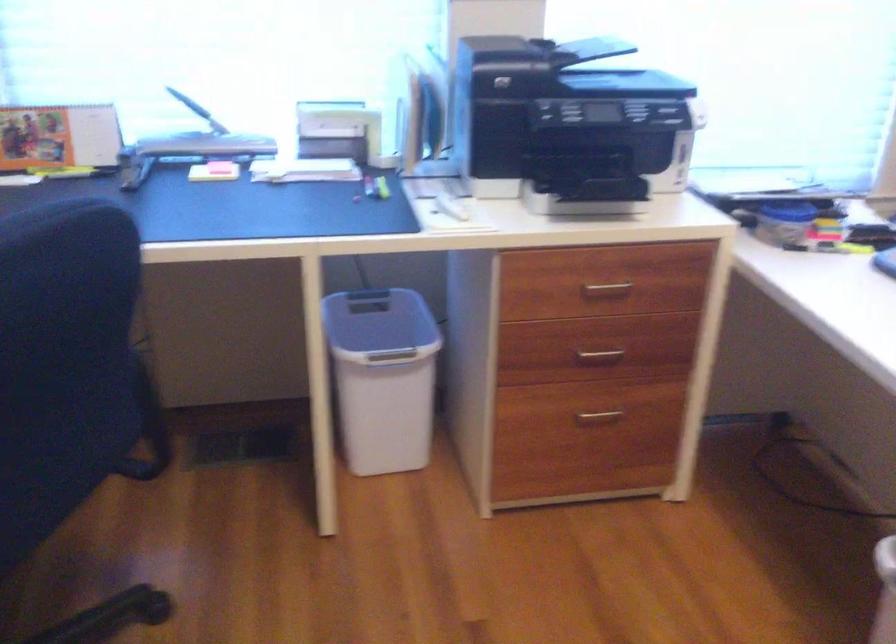
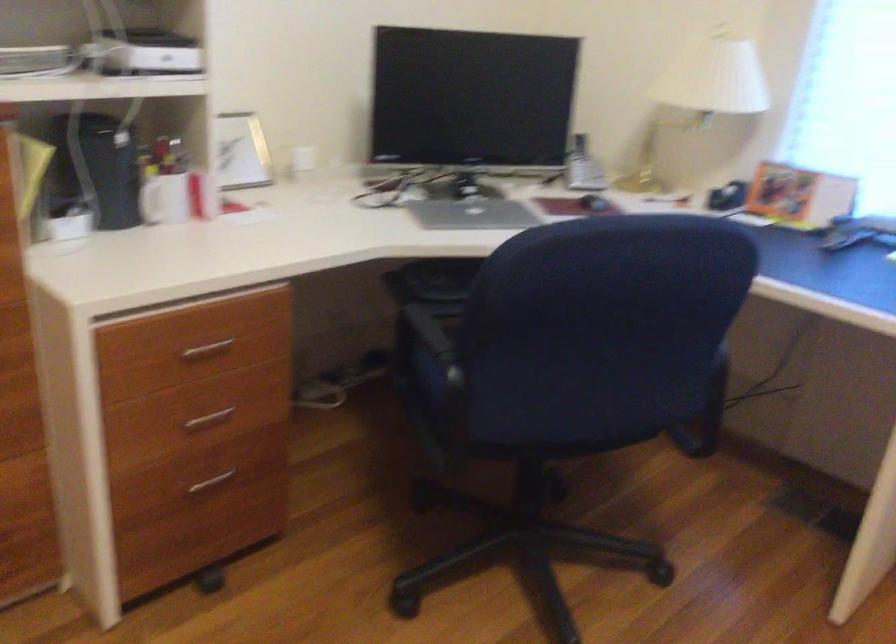
Question: The camera is either moving clockwise (left) or counter-clockwise (right) around the object. The first image is from the beginning of the video and the second image is from the end. Is the camera moving left or right when shooting the video?

Choices:
 (A) Left
 (B) Right

Answer: (B)